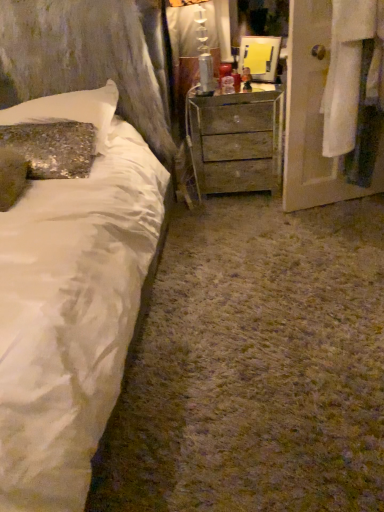
In order to click on vacant area that lies in front of wooden chest of drawers at center in this screenshot , I will do `click(236, 218)`.